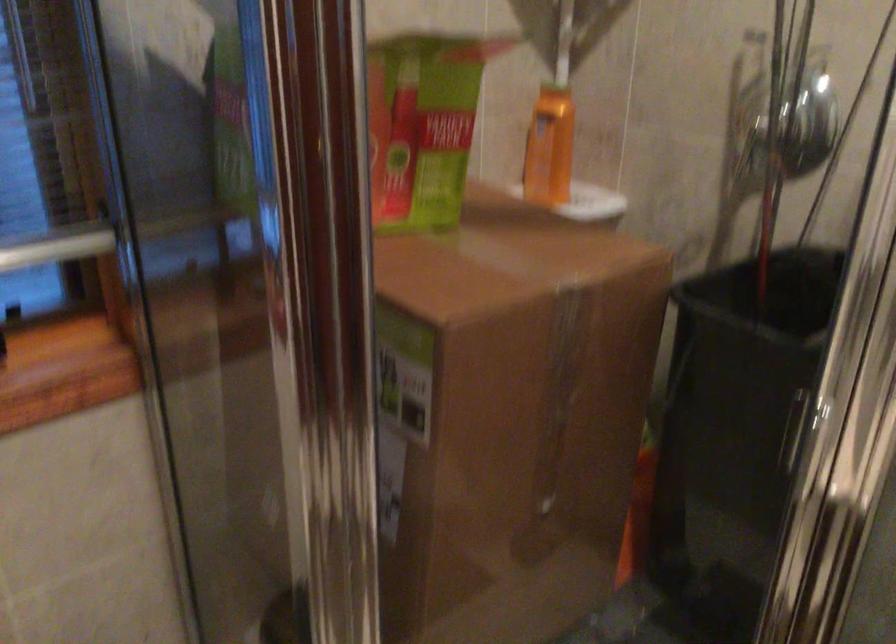
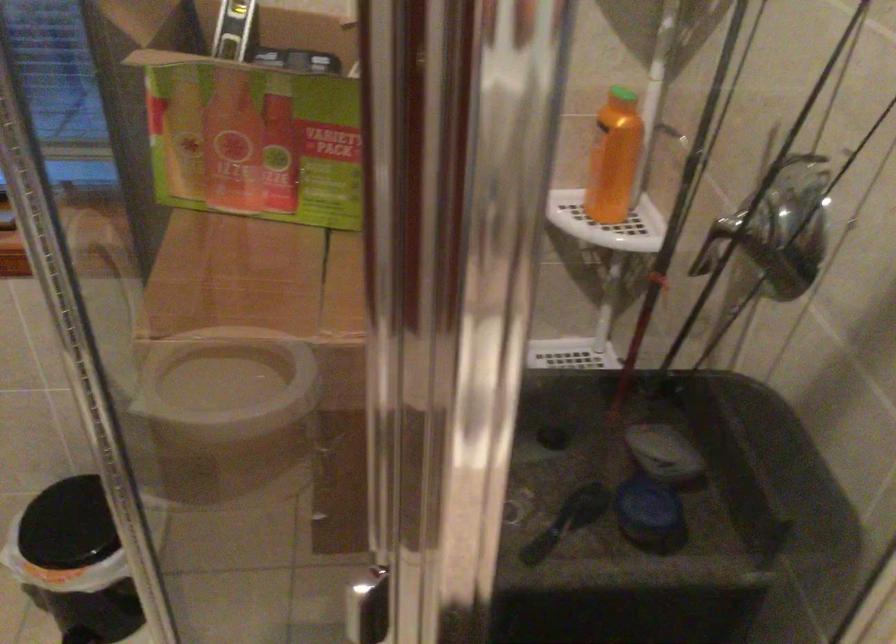
In the second image, find the point that corresponds to point 513,361 in the first image.

(244, 383)